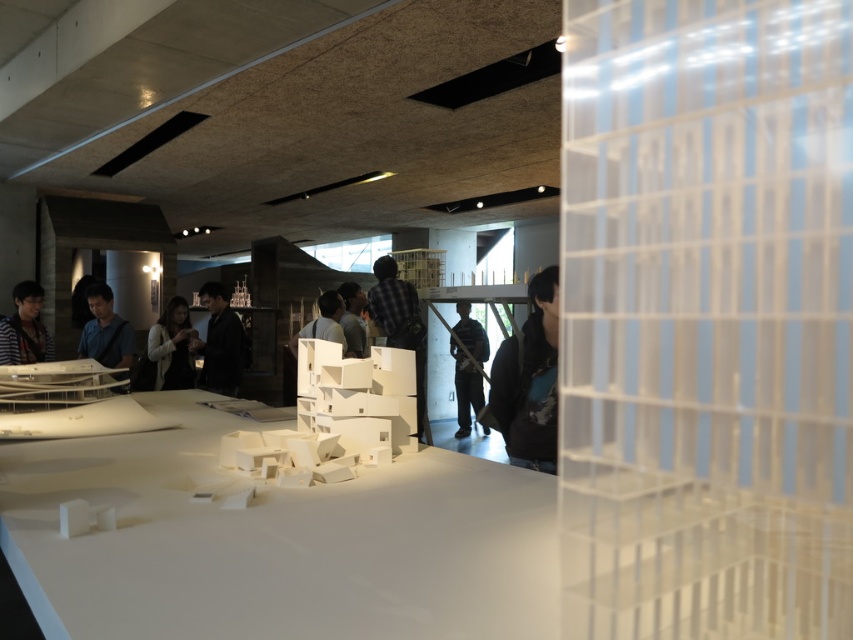
Which is in front, point (490, 376) or point (357, 292)?

Positioned in front is point (490, 376).

Which is behind, point (524, 369) or point (352, 321)?

Positioned behind is point (352, 321).

You are a GUI agent. You are given a task and a screenshot of the screen. Output one action in this format:
    pyautogui.click(x=<x>, y=<y>)
    Task: Click on the dark blue hoodie at center
    This screenshot has width=853, height=640.
    Given the screenshot: What is the action you would take?
    pyautogui.click(x=529, y=380)

Between white matte mannequin at center and dark gray shirt at center, which one has less height?

white matte mannequin at center

Is point (320, 326) positioned after point (352, 307)?

No, (320, 326) is closer to viewer.

Which is in front, point (316, 321) or point (355, 308)?

Point (316, 321) is in front.

The width and height of the screenshot is (853, 640). I want to click on white matte mannequin at center, so click(x=323, y=323).

Which is below, matte black shirt at center or white matte mannequin at center?

matte black shirt at center is lower down.

Locate an element on the screen. The width and height of the screenshot is (853, 640). matte black shirt at center is located at coordinates (467, 365).